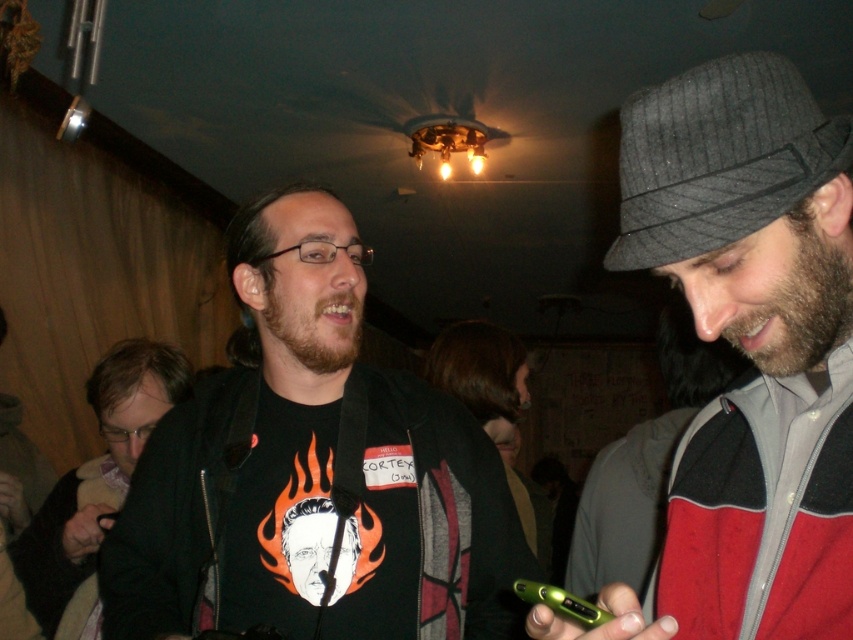
Question: Which point is farther to the camera?

Choices:
 (A) matte black jacket at left
 (B) gray wool hat at right
 (C) matte black t-shirt with flame design at center

Answer: (A)

Question: Is matte black t-shirt with flame design at center positioned in front of matte black jacket at left?

Choices:
 (A) yes
 (B) no

Answer: (A)

Question: In this image, where is matte black t-shirt with flame design at center located relative to gray wool hat at right?

Choices:
 (A) right
 (B) left

Answer: (B)

Question: Which of the following is the farthest from the observer?

Choices:
 (A) matte black jacket at left
 (B) matte black t-shirt with flame design at center

Answer: (A)

Question: Observing the image, what is the correct spatial positioning of matte black t-shirt with flame design at center in reference to matte black jacket at left?

Choices:
 (A) right
 (B) left

Answer: (A)

Question: Which point appears closest to the camera in this image?

Choices:
 (A) (762, 294)
 (B) (132, 378)
 (C) (332, 339)

Answer: (A)